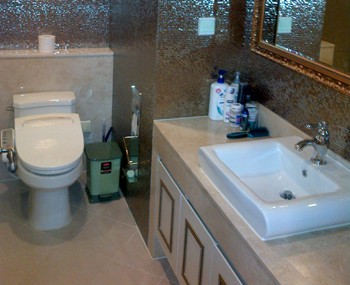
Identify the location of cabinets. (198, 250).